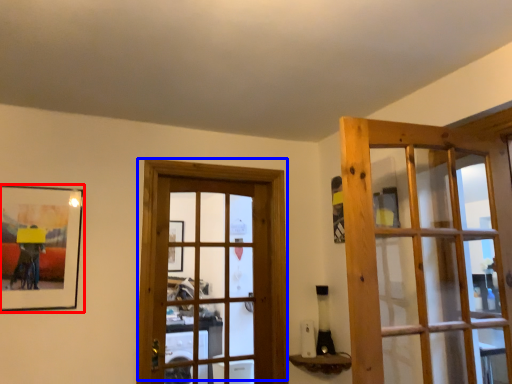
Question: Which point is further to the camera, picture frame (highlighted by a red box) or door (highlighted by a blue box)?

Choices:
 (A) picture frame
 (B) door

Answer: (B)